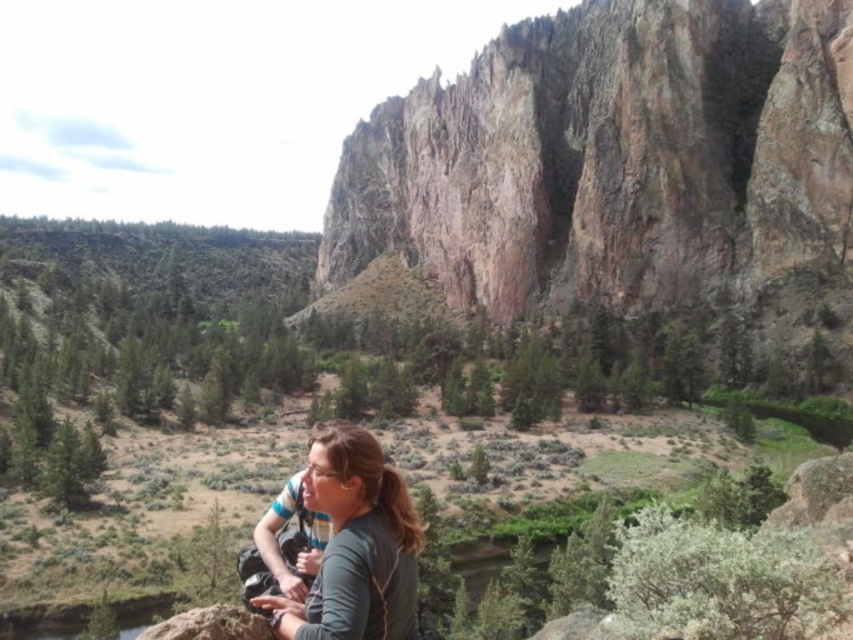
Question: Observing the image, what is the correct spatial positioning of rustic rock cliff at upper right in reference to gray matte shirt at center?

Choices:
 (A) above
 (B) below

Answer: (A)

Question: Where is rustic rock cliff at upper right located in relation to brown rough rock at lower left in the image?

Choices:
 (A) right
 (B) left

Answer: (A)

Question: Which point is closer to the camera?

Choices:
 (A) gray matte shirt at center
 (B) rustic rock cliff at upper right
 (C) brown rough rock at lower left

Answer: (C)

Question: Which point is farther to the camera?

Choices:
 (A) gray matte shirt at center
 (B) rustic rock cliff at upper right
 (C) brown rough rock at lower left

Answer: (B)

Question: Does rustic rock cliff at upper right lie behind gray matte shirt at center?

Choices:
 (A) yes
 (B) no

Answer: (A)

Question: Which is farther from the brown rough rock at lower left?

Choices:
 (A) gray matte shirt at center
 (B) rustic rock cliff at upper right

Answer: (B)